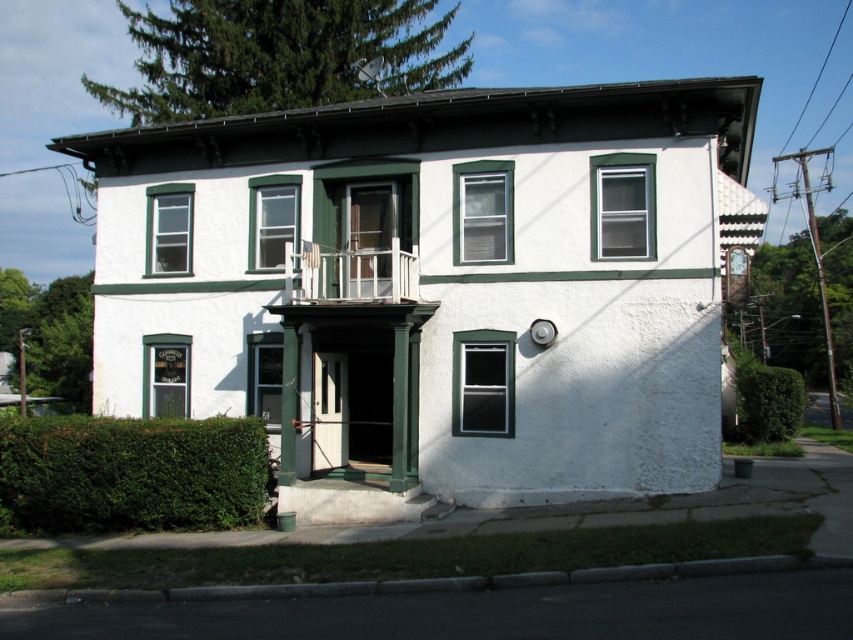
Question: Which point is farther to the camera?

Choices:
 (A) (231, 476)
 (B) (328, 262)

Answer: (B)

Question: Can you confirm if green painted wood trim at center is bigger than green leafy hedge at lower left?

Choices:
 (A) yes
 (B) no

Answer: (A)

Question: Is green painted wood trim at center bigger than green leafy hedge at lower left?

Choices:
 (A) no
 (B) yes

Answer: (B)

Question: Which point is farther from the camera taking this photo?

Choices:
 (A) (537, 173)
 (B) (223, 493)

Answer: (A)

Question: Can you confirm if green painted wood trim at center is bigger than green leafy hedge at lower left?

Choices:
 (A) no
 (B) yes

Answer: (B)

Question: Which object is closer to the camera taking this photo?

Choices:
 (A) green painted wood trim at center
 (B) green leafy hedge at lower left

Answer: (B)